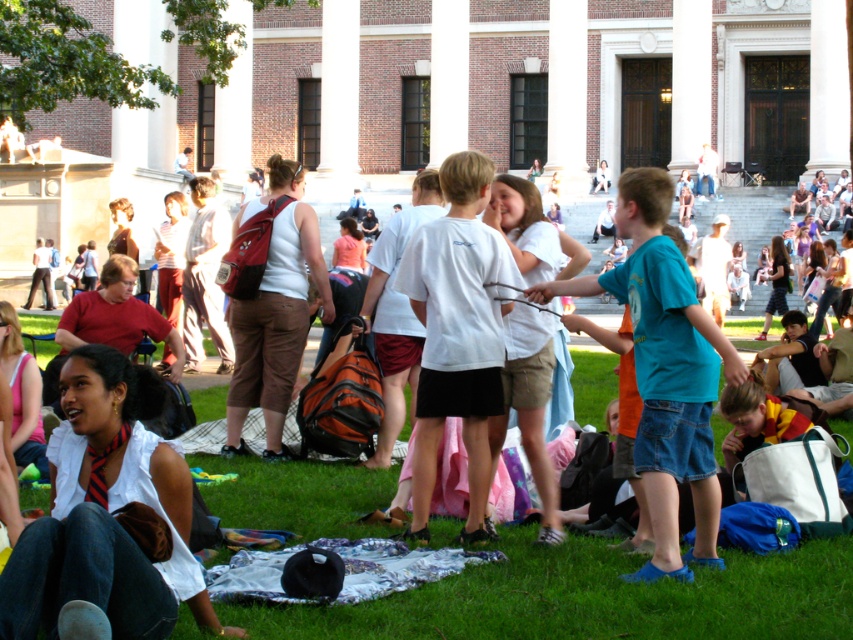
Question: Can you confirm if teal denim shorts at center is positioned to the left of white matte t-shirt at center?

Choices:
 (A) yes
 (B) no

Answer: (B)

Question: Is teal denim shorts at center positioned behind white matte t-shirt at center?

Choices:
 (A) yes
 (B) no

Answer: (B)

Question: Which object appears closest to the camera in this image?

Choices:
 (A) white matte t-shirt at center
 (B) teal denim shorts at center

Answer: (B)

Question: Can you confirm if teal denim shorts at center is thinner than white matte t-shirt at center?

Choices:
 (A) no
 (B) yes

Answer: (A)

Question: Which point is farther from the camera taking this photo?

Choices:
 (A) (700, 419)
 (B) (454, 381)

Answer: (B)